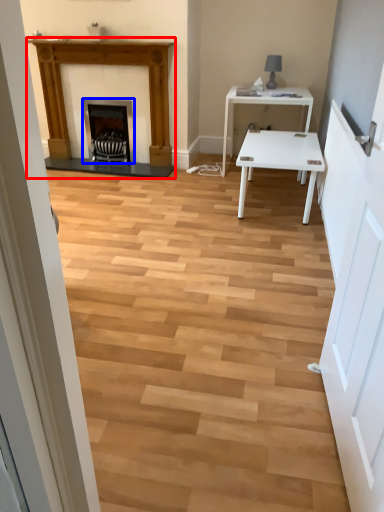
Question: Which of the following is the farthest to the observer, fireplace (highlighted by a red box) or fireplace (highlighted by a blue box)?

Choices:
 (A) fireplace
 (B) fireplace

Answer: (B)